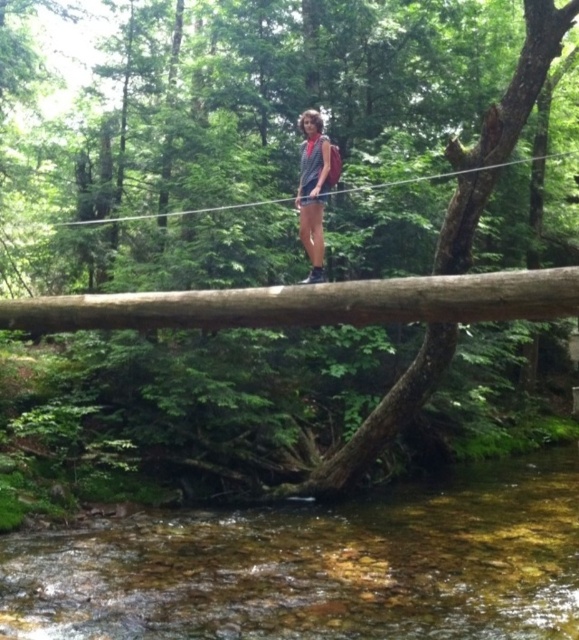
Is brown rough log at center to the left of gray fabric shirt at center from the viewer's perspective?

Correct, you'll find brown rough log at center to the left of gray fabric shirt at center.

Is brown rough log at center smaller than gray fabric shirt at center?

No.

Find the location of a particular element. This screenshot has height=640, width=579. brown rough log at center is located at coordinates (310, 304).

Between clear water at center and gray fabric shirt at center, which one appears on the left side from the viewer's perspective?

gray fabric shirt at center

Which is in front, point (489, 636) or point (335, 156)?

Positioned in front is point (489, 636).

Identify the location of clear water at center. (317, 566).

The image size is (579, 640). What are the coordinates of `clear water at center` in the screenshot? It's located at (317, 566).

Is clear water at center to the right of brown rough log at center from the viewer's perspective?

Correct, you'll find clear water at center to the right of brown rough log at center.

Is clear water at center wider than brown rough log at center?

No.

Find the location of a particular element. Image resolution: width=579 pixels, height=640 pixels. clear water at center is located at coordinates (317, 566).

This screenshot has width=579, height=640. Find the location of `clear water at center`. clear water at center is located at coordinates (317, 566).